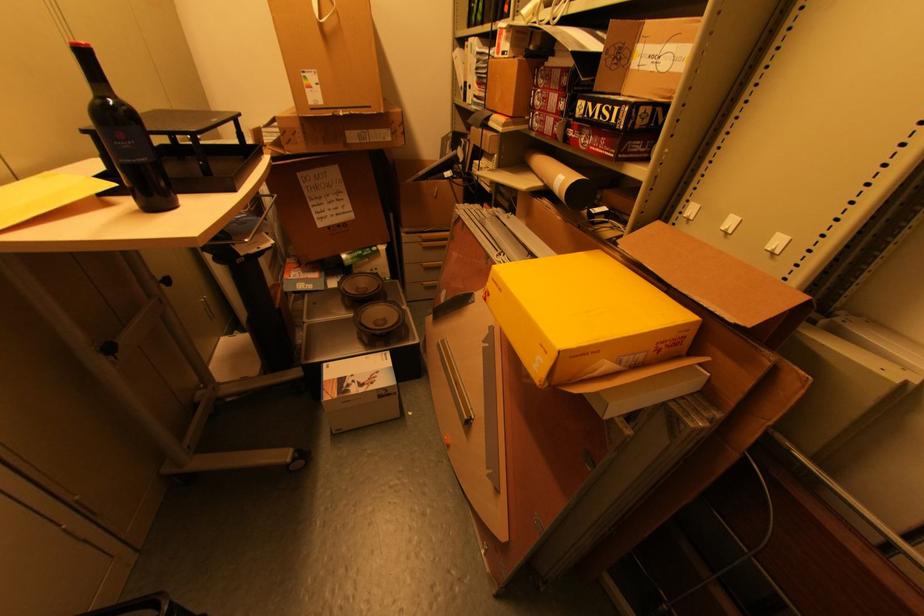
This screenshot has height=616, width=924. I want to click on MSI cardboard box, so click(618, 113).